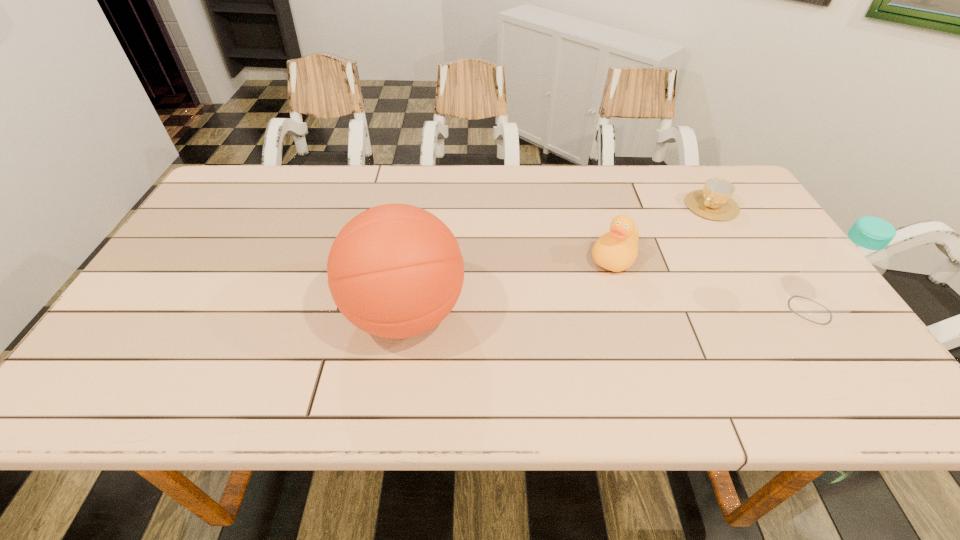
Find the location of a particular element. This screenshot has height=540, width=960. vacant space situated with the handle on the side of the shortest object is located at coordinates (677, 235).

Identify the location of vacant space located 0.290m on the face of the third object from right to left. (556, 356).

This screenshot has height=540, width=960. Identify the location of free space located 0.230m on the face of the third object from right to left. (568, 337).

Where is `vacant space located 0.320m on the face of the third object from right to left`? Image resolution: width=960 pixels, height=540 pixels. vacant space located 0.320m on the face of the third object from right to left is located at coordinates (550, 366).

At what (x,y) coordinates should I click in order to perform the action: click on object that is at the far edge. Please return your answer as a coordinate pair (x, y). This screenshot has width=960, height=540. Looking at the image, I should click on (714, 201).

Where is `object that is at the near edge`? object that is at the near edge is located at coordinates (395, 271).

Image resolution: width=960 pixels, height=540 pixels. Identify the location of bottle that is positioned at the right edge. (828, 288).

Locate an element on the screen. This screenshot has width=960, height=540. cup that is at the right edge is located at coordinates (714, 201).

I want to click on object that is at the far right corner, so click(714, 201).

The image size is (960, 540). Find the location of `vacant space at the far edge`. vacant space at the far edge is located at coordinates (668, 203).